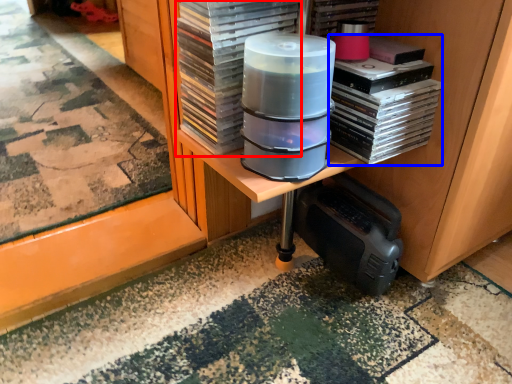
Question: Which of the following is the farthest to the observer, paperback book (highlighted by a red box) or book (highlighted by a blue box)?

Choices:
 (A) paperback book
 (B) book

Answer: (B)